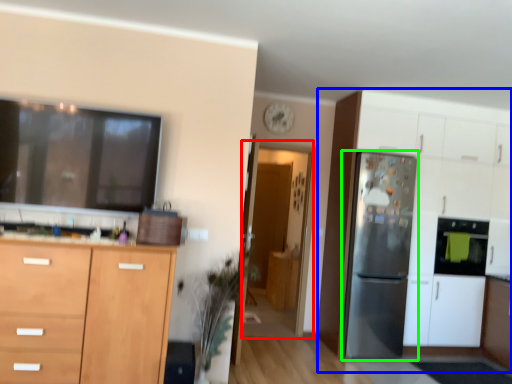
Question: Which is farther away from glass door (highlighted by a red box)? cabinetry (highlighted by a blue box) or refrigerator (highlighted by a green box)?

Choices:
 (A) cabinetry
 (B) refrigerator

Answer: (B)